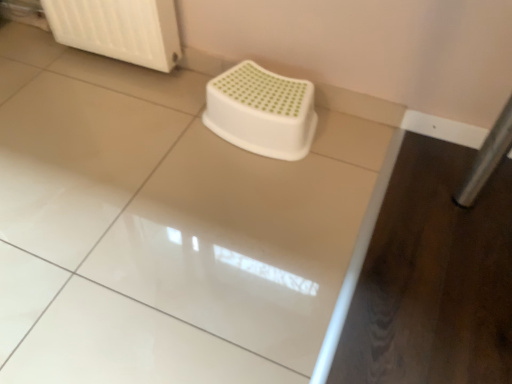
Identify the location of free space in front of white plastic stool at center. The image size is (512, 384). 256,196.